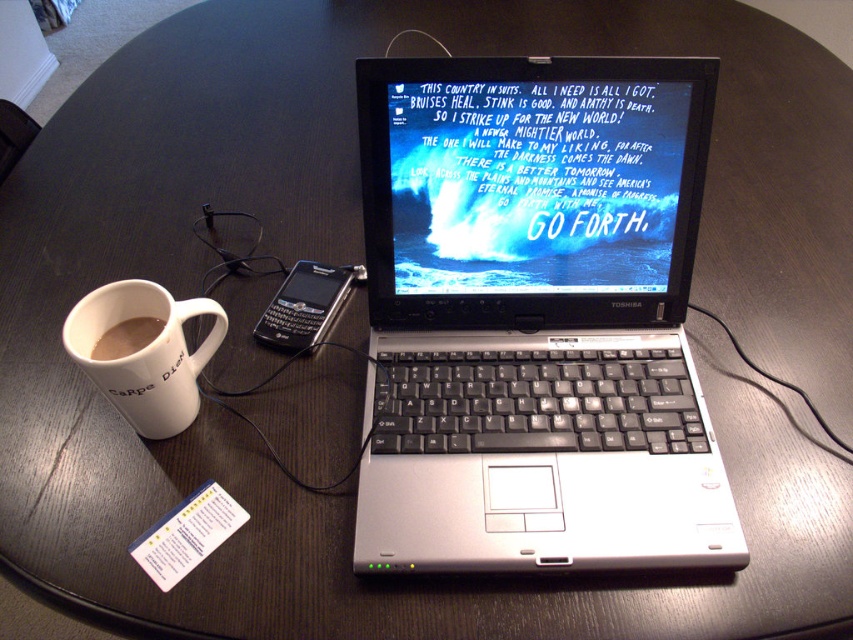
You are organizing your desk and need to place both the white ceramic mug at left and the black plastic smartphone at center into a drawer. The drawer has a width of 15 cm. If the mug is wider than the smartphone, can both items fit side by side in the drawer?

The white ceramic mug at left is wider than the black plastic smartphone at center. Since the mug is wider, if the combined width of both items exceeds 15 cm, they might not fit. However, without exact measurements, it is uncertain. Please check their total width.

You are organizing a coffee station and have two mugs, the white ceramic mug at left and the brown matte mug at left. Which one is taller?

The white ceramic mug at left is much taller than the brown matte mug at left.